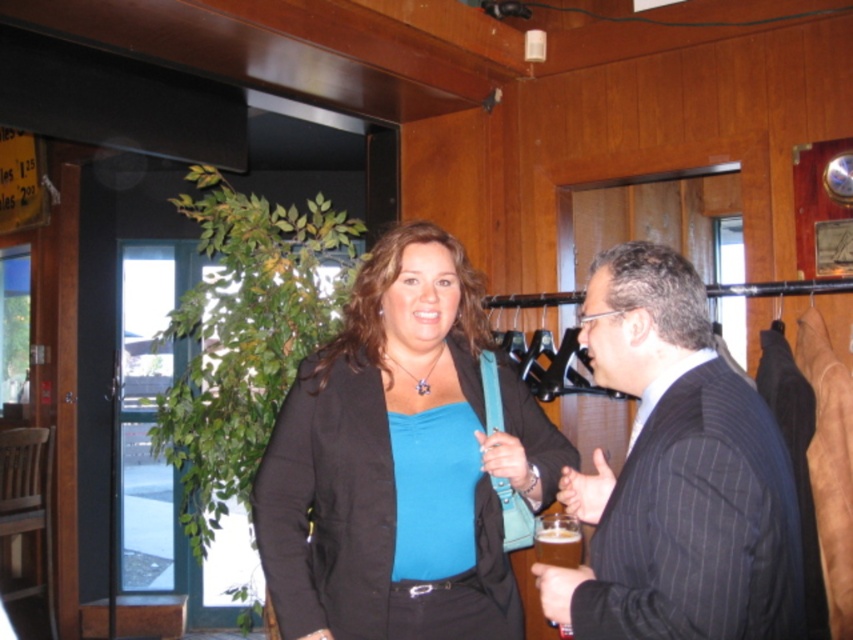
Question: Can you confirm if matte black blazer at center is positioned below black pinstripe suit at center?

Choices:
 (A) no
 (B) yes

Answer: (B)

Question: Does matte black blazer at center have a greater width compared to black pinstripe suit at center?

Choices:
 (A) yes
 (B) no

Answer: (A)

Question: Which object appears closest to the camera in this image?

Choices:
 (A) matte black blazer at center
 (B) black pinstripe suit at center

Answer: (B)

Question: Among these points, which one is farthest from the camera?

Choices:
 (A) (442, 483)
 (B) (593, 484)

Answer: (B)

Question: Can you confirm if matte black blazer at center is thinner than black pinstripe suit at center?

Choices:
 (A) no
 (B) yes

Answer: (A)